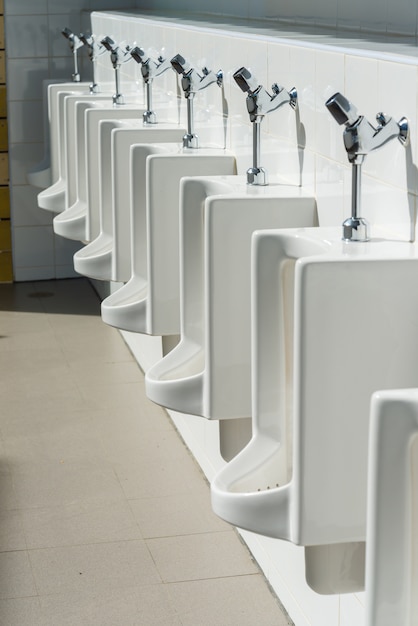
The height and width of the screenshot is (626, 418). In order to click on piping connecting to urinals in this screenshot , I will do `click(354, 230)`, `click(254, 177)`, `click(192, 140)`, `click(150, 115)`, `click(117, 98)`, `click(96, 86)`, `click(75, 79)`.